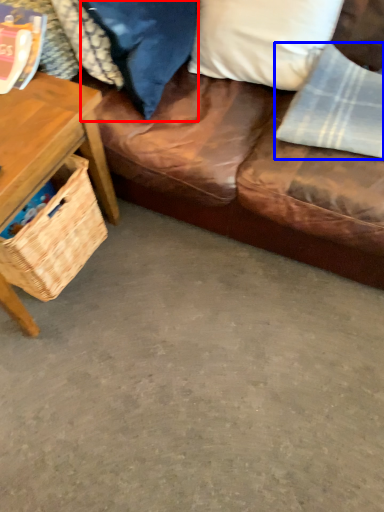
Question: Among these objects, which one is nearest to the camera, pillow (highlighted by a red box) or material (highlighted by a blue box)?

Choices:
 (A) pillow
 (B) material

Answer: (A)